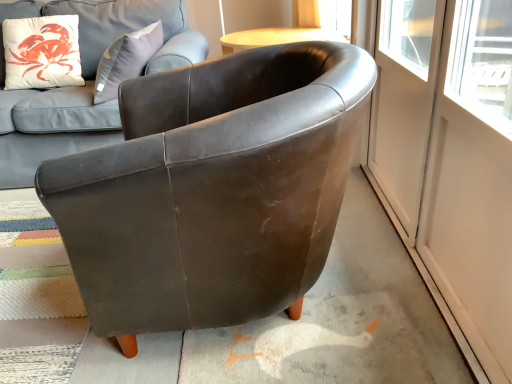
Question: From the image's perspective, is matte brown leather couch at upper left located above brown leather armchair at center?

Choices:
 (A) yes
 (B) no

Answer: (A)

Question: Can you confirm if matte brown leather couch at upper left is wider than brown leather armchair at center?

Choices:
 (A) yes
 (B) no

Answer: (A)

Question: Is matte brown leather couch at upper left far away from brown leather armchair at center?

Choices:
 (A) yes
 (B) no

Answer: (A)

Question: From a real-world perspective, is matte brown leather couch at upper left below brown leather armchair at center?

Choices:
 (A) yes
 (B) no

Answer: (B)

Question: Is matte brown leather couch at upper left at the right side of brown leather armchair at center?

Choices:
 (A) no
 (B) yes

Answer: (A)

Question: Visually, is transparent glass screen door at right, which is the second screen door from left to right, positioned to the left or to the right of matte white cushion at upper left?

Choices:
 (A) left
 (B) right

Answer: (B)

Question: Considering the positions of transparent glass screen door at right, which is counted as the 1th screen door, starting from the right, and matte white cushion at upper left in the image, is transparent glass screen door at right, which is counted as the 1th screen door, starting from the right, wider or thinner than matte white cushion at upper left?

Choices:
 (A) thin
 (B) wide

Answer: (A)

Question: From the image's perspective, is transparent glass screen door at right, which is the second screen door from left to right, located above or below matte white cushion at upper left?

Choices:
 (A) above
 (B) below

Answer: (B)

Question: Looking at the image, does transparent glass screen door at right, which is counted as the 1th screen door, starting from the right, seem bigger or smaller compared to matte white cushion at upper left?

Choices:
 (A) small
 (B) big

Answer: (A)

Question: In the image, is transparent glass screen door at right, marked as the first screen door in a left-to-right arrangement, on the left side or the right side of matte brown leather couch at upper left?

Choices:
 (A) right
 (B) left

Answer: (A)

Question: Is transparent glass screen door at right, which is the 2th screen door from right to left, wider or thinner than matte brown leather couch at upper left?

Choices:
 (A) thin
 (B) wide

Answer: (A)

Question: From a real-world perspective, is transparent glass screen door at right, which is the 2th screen door from right to left, above or below matte brown leather couch at upper left?

Choices:
 (A) above
 (B) below

Answer: (B)

Question: Is transparent glass screen door at right, marked as the first screen door in a left-to-right arrangement, bigger or smaller than matte brown leather couch at upper left?

Choices:
 (A) small
 (B) big

Answer: (A)

Question: Does point (61, 23) appear closer or farther from the camera than point (97, 261)?

Choices:
 (A) closer
 (B) farther

Answer: (B)

Question: Looking at the image, does matte white cushion at upper left seem bigger or smaller compared to brown leather armchair at center?

Choices:
 (A) big
 (B) small

Answer: (B)